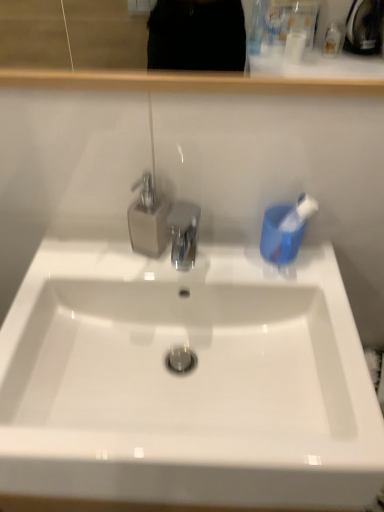
The height and width of the screenshot is (512, 384). What are the coordinates of `vacant space to the right of transparent plastic tap at center` in the screenshot? It's located at (226, 261).